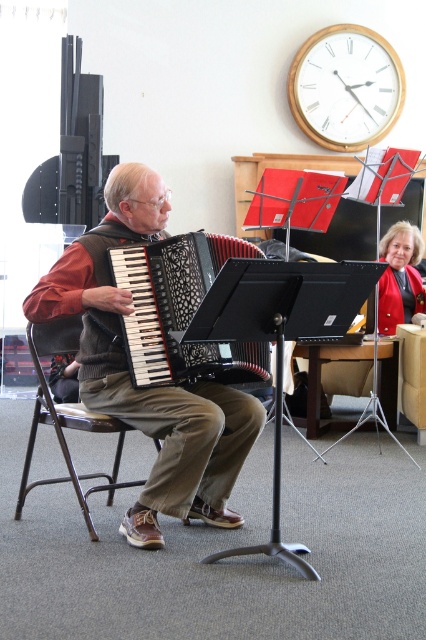
You are a sound technician setting up a microphone for the accordion player. The microphone stand you have is 2.5 meters long. Can you place the microphone stand between you and the matte black accordion at center without it being too short?

The distance between you and the matte black accordion at center is 2.83 meters. Since the microphone stand is only 2.5 meters long, it is shorter than the required distance. Therefore, the microphone stand would be too short to reach the accordion at that distance.

You are a stagehand setting up for a small performance. You have to place a 32 cm wide decorative panel between the matte black accordion at center and the metallic silver chair at left. Will there be enough space?

The distance between the matte black accordion at center and the metallic silver chair at left is 31.77 centimeters. Since the decorative panel is 32 cm wide, it will not fit as the space is slightly smaller than the panel.